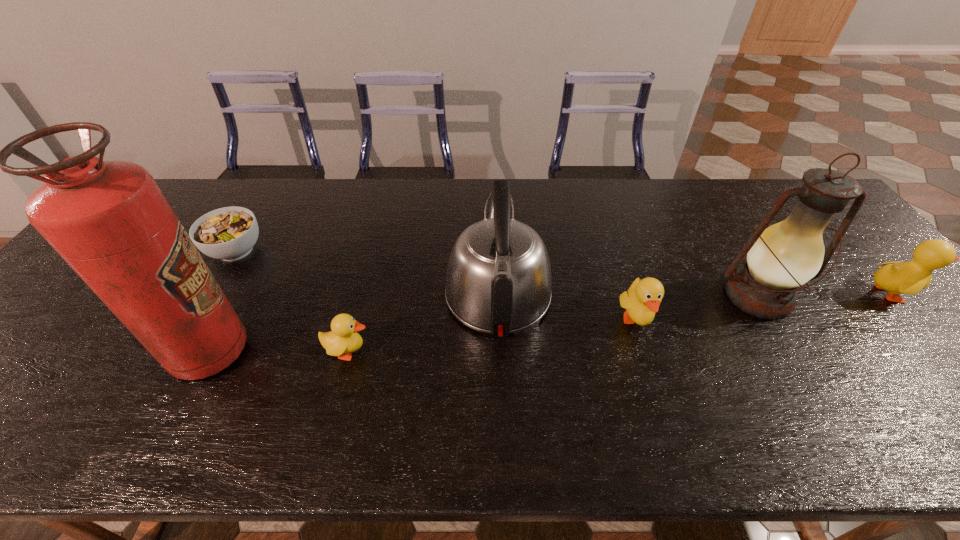
This screenshot has height=540, width=960. In order to click on the shortest duckling in this screenshot , I will do `click(343, 339)`.

Identify the location of the fifth object from right to left. (343, 339).

The image size is (960, 540). I want to click on the second shortest duckling, so click(643, 298).

This screenshot has height=540, width=960. In order to click on the third object from right to left in this screenshot , I will do `click(643, 298)`.

The width and height of the screenshot is (960, 540). In order to click on the rightmost duckling in this screenshot , I will do `click(911, 277)`.

At what (x,y) coordinates should I click in order to perform the action: click on the fourth object from right to left. Please return your answer as a coordinate pair (x, y). This screenshot has height=540, width=960. Looking at the image, I should click on (498, 281).

At what (x,y) coordinates should I click in order to perform the action: click on the third tallest object. Please return your answer as a coordinate pair (x, y). The width and height of the screenshot is (960, 540). Looking at the image, I should click on (498, 281).

Find the location of `soup bowl`. soup bowl is located at coordinates (229, 233).

This screenshot has height=540, width=960. Identify the location of fire extinguisher. [x=109, y=220].

At what (x,y) coordinates should I click in order to perform the action: click on the sixth shortest object. Please return your answer as a coordinate pair (x, y). Looking at the image, I should click on coord(781,258).